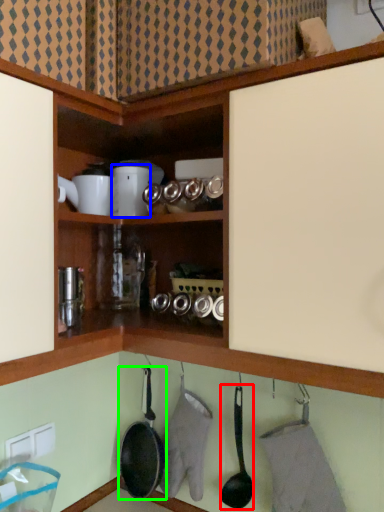
Question: Which object is the farthest from frying pan (highlighted by a red box)? Choose among these: appliance (highlighted by a blue box) or frying pan (highlighted by a green box).

Choices:
 (A) appliance
 (B) frying pan

Answer: (A)